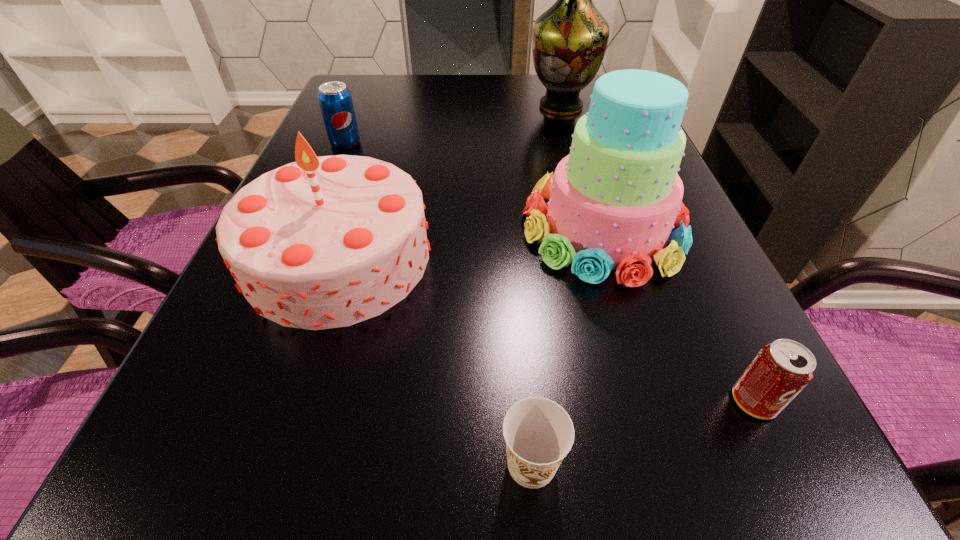
Locate an element on the screen. The image size is (960, 540). vacant point located 0.180m on the left of the vase is located at coordinates (462, 106).

Locate an element on the screen. This screenshot has height=540, width=960. blank space located on the back of the cake is located at coordinates click(x=572, y=126).

Find the location of a particular element. The image size is (960, 540). vacant space located on the right of the birthday cake is located at coordinates (560, 257).

Locate an element on the screen. free space located 0.180m on the front of the second farthest object is located at coordinates (324, 195).

At what (x,y) coordinates should I click in order to perform the action: click on vacant region located on the left of the shorter soda can. Please return your answer as a coordinate pair (x, y). Image resolution: width=960 pixels, height=540 pixels. Looking at the image, I should click on (636, 401).

Find the location of a particular element. This screenshot has width=960, height=540. free region located 0.200m on the left of the nearest object is located at coordinates (336, 463).

You are a GUI agent. You are given a task and a screenshot of the screen. Output one action in this format:
    pyautogui.click(x=<x>, y=<y>)
    Task: Click on the object that is at the far edge
    The image size is (960, 540).
    Given the screenshot: What is the action you would take?
    pyautogui.click(x=569, y=40)

This screenshot has height=540, width=960. In order to click on object that is at the near edge in this screenshot , I will do click(539, 433).

Locate an element on the screen. birthday cake that is at the left edge is located at coordinates (324, 242).

The height and width of the screenshot is (540, 960). I want to click on pop soda that is at the left edge, so click(335, 100).